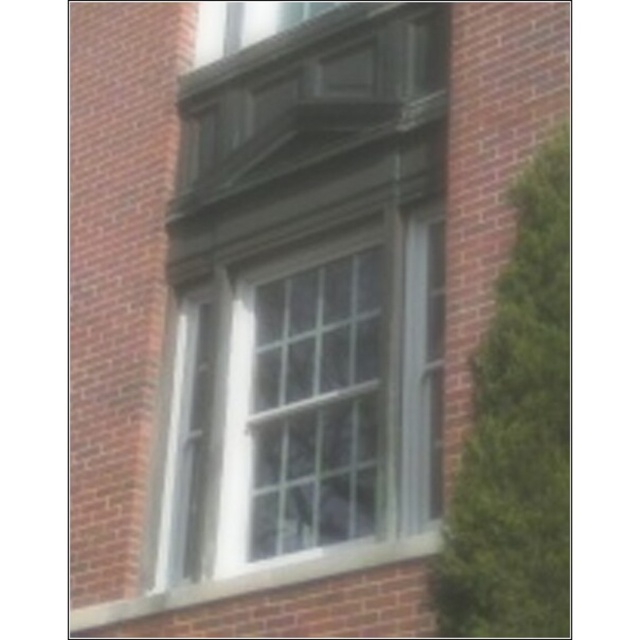
You are standing in front of a brick building with a window and a tree. You notice two points marked on the wall. One is at point coordinates point (x=332, y=371) and the other is at point coordinates point (x=348, y=566). Which of these two points is closer to you?

Point (x=332, y=371) is further to the camera than point (x=348, y=566), so the point closer to you is point (x=348, y=566).

You are standing in front of the brick building and want to touch the white painted wood at lower center and the white glass window at center. Which object is closer to you?

The white glass window at center is closer to you than the white painted wood at lower center, so you can touch the white glass window at center first.

You are an architect designing a new building and want to ensure the white glass window at center and the white painted wood at lower center are proportionally balanced. Based on the scene, which object should be adjusted in size to achieve this balance?

The white painted wood at lower center is smaller than the white glass window at center. To achieve proportional balance, the white painted wood at lower center should be enlarged to match the size of the white glass window at center.